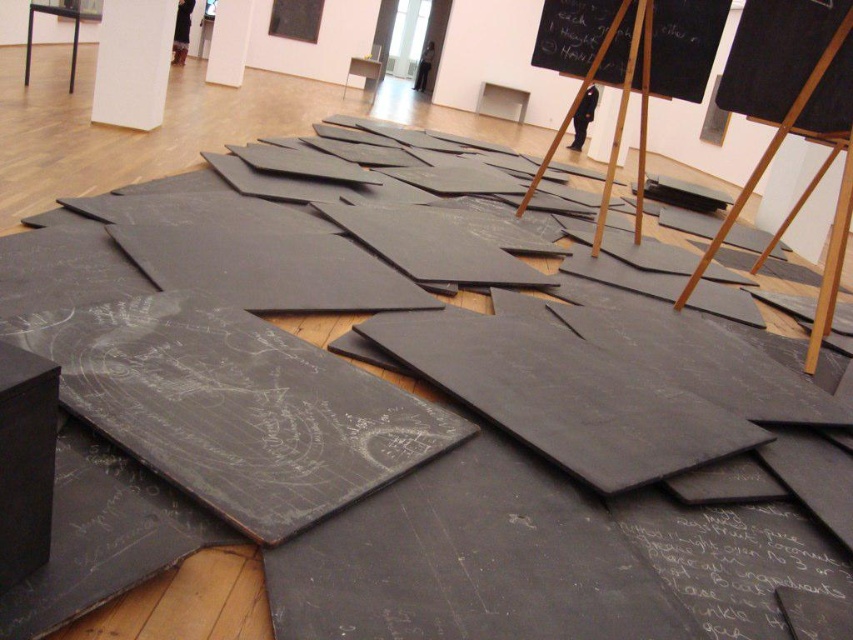
Question: Among these points, which one is farthest from the camera?

Choices:
 (A) (624, 99)
 (B) (762, 54)
 (C) (701, 506)
 (D) (692, 28)

Answer: (D)

Question: Does black chalkboard at center have a larger size compared to wooden easel at center?

Choices:
 (A) no
 (B) yes

Answer: (A)

Question: Is wooden easel at center further to camera compared to smooth wood easel at center?

Choices:
 (A) no
 (B) yes

Answer: (A)

Question: Is wooden easel at center below smooth wood easel at center?

Choices:
 (A) no
 (B) yes

Answer: (B)

Question: Which of the following is the farthest from the observer?

Choices:
 (A) (630, 4)
 (B) (686, 516)
 (C) (837, 84)

Answer: (A)

Question: Which object appears closest to the camera in this image?

Choices:
 (A) wooden easel at center
 (B) smooth wood easel at center
 (C) black chalkboard at upper center

Answer: (A)